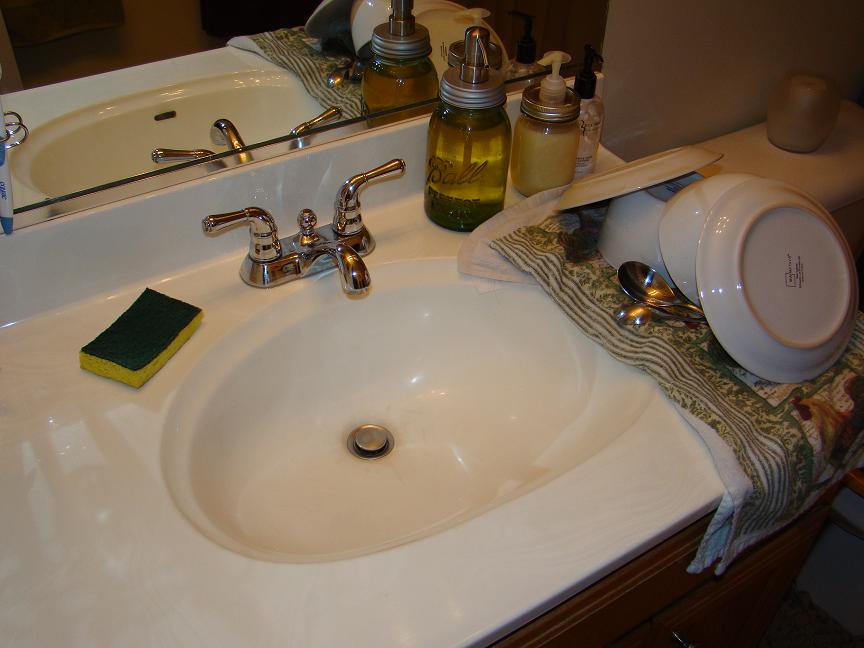
Identify the location of bottle. (475, 170).